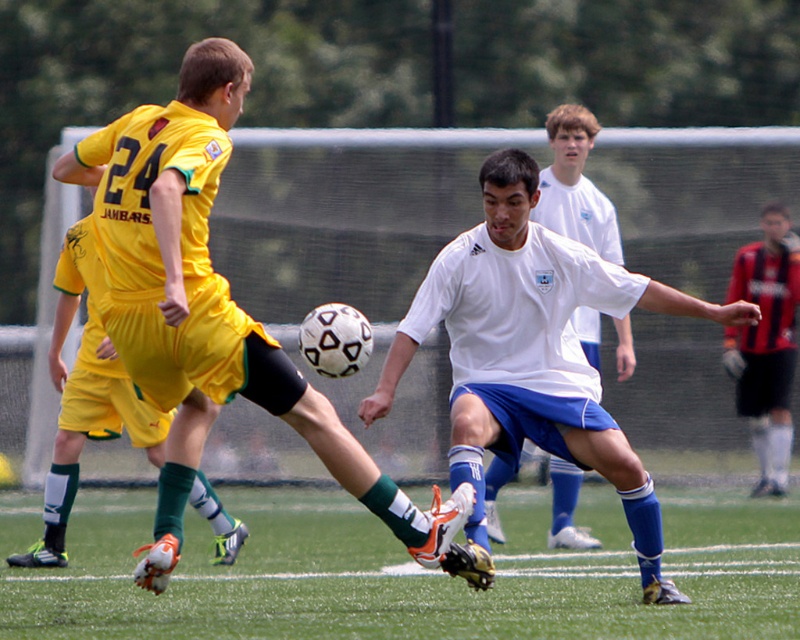
Is point (310, 582) farther from viewer compared to point (525, 449)?

No, it is in front of (525, 449).

Based on the photo, is green grass at lower center to the left of white matte jersey at center from the viewer's perspective?

In fact, green grass at lower center is to the right of white matte jersey at center.

In order to click on green grass at lower center in this screenshot , I will do `click(416, 573)`.

Who is taller, white matte soccer ball at center or red jersey at right?

With more height is red jersey at right.

Measure the distance between white matte soccer ball at center and camera.

white matte soccer ball at center is 9.85 meters from camera.

At what (x,y) coordinates should I click in order to perform the action: click on white matte soccer ball at center. Please return your answer as a coordinate pair (x, y). Looking at the image, I should click on (532, 358).

Is green grass at lower center above matte yellow shorts at left?

No.

Is point (152, 636) positioned before point (96, 401)?

Yes, it is.

Which is in front, point (537, 576) or point (130, 403)?

Point (537, 576) is in front.

Locate an element on the screen. The height and width of the screenshot is (640, 800). green grass at lower center is located at coordinates pyautogui.click(x=416, y=573).